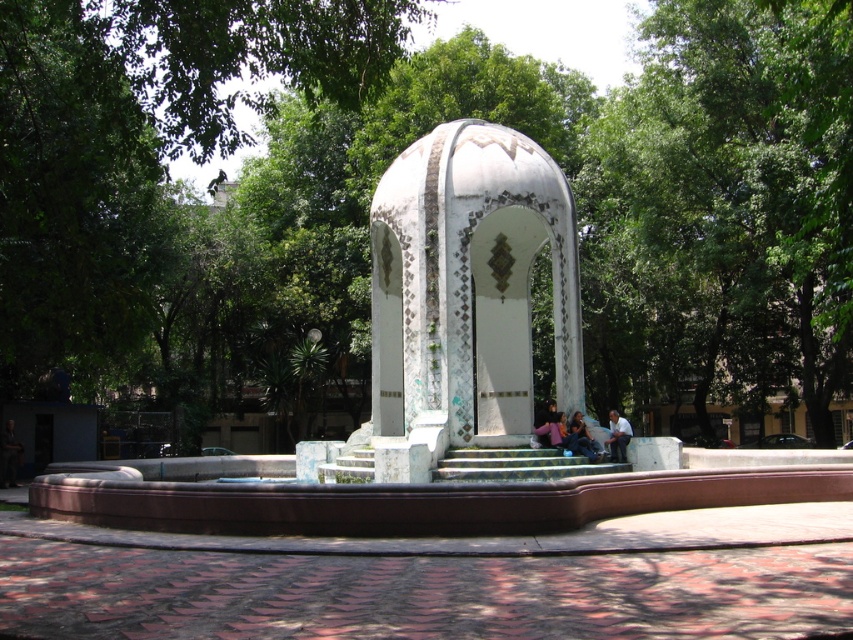
You are standing in the park and see the blue denim jeans at lower center. Where exactly are they located in the park?

The blue denim jeans at lower center are located at point (583, 438) in the park.

You are a photographer standing in the park and want to capture both the blue denim jeans at lower center and the blue denim jeans at center in your shot. Which pair of jeans is narrower in width?

The blue denim jeans at lower center is thinner than the blue denim jeans at center, so the pair at lower center is narrower in width.